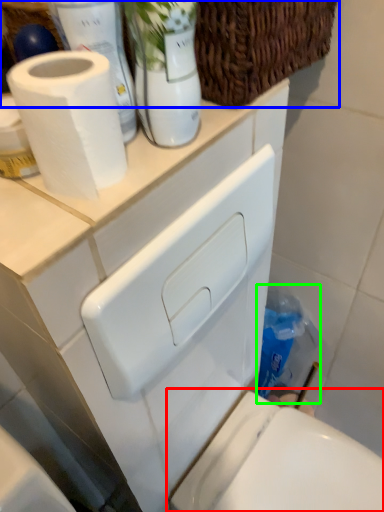
Question: Estimate the real-world distances between objects in this image. Which object is closer to toilet (highlighted by a red box), basket (highlighted by a blue box) or cleaning product (highlighted by a green box)?

Choices:
 (A) basket
 (B) cleaning product

Answer: (B)